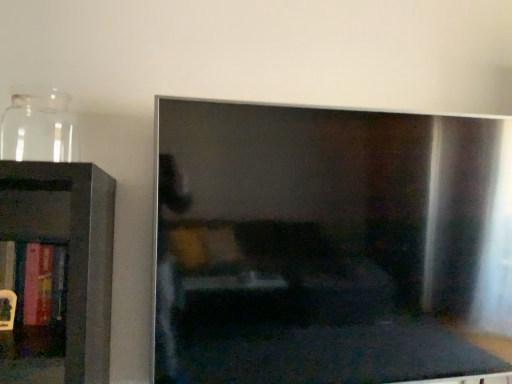
Question: Is transparent glass jar at left next to hardcover book at left?

Choices:
 (A) no
 (B) yes

Answer: (A)

Question: Considering the relative sizes of transparent glass jar at left and hardcover book at left in the image provided, is transparent glass jar at left shorter than hardcover book at left?

Choices:
 (A) no
 (B) yes

Answer: (B)

Question: Considering the relative positions of transparent glass jar at left and hardcover book at left in the image provided, is transparent glass jar at left behind hardcover book at left?

Choices:
 (A) no
 (B) yes

Answer: (A)

Question: Considering the relative positions of transparent glass jar at left and hardcover book at left in the image provided, is transparent glass jar at left in front of hardcover book at left?

Choices:
 (A) yes
 (B) no

Answer: (A)

Question: From a real-world perspective, is transparent glass jar at left located higher than hardcover book at left?

Choices:
 (A) yes
 (B) no

Answer: (A)

Question: From the image's perspective, is transparent glass jar at left located above hardcover book at left?

Choices:
 (A) no
 (B) yes

Answer: (B)

Question: Is hardcover book at left oriented towards transparent glass jar at left?

Choices:
 (A) no
 (B) yes

Answer: (A)

Question: Is hardcover book at left at the left side of transparent glass jar at left?

Choices:
 (A) yes
 (B) no

Answer: (A)

Question: From the image's perspective, does hardcover book at left appear lower than transparent glass jar at left?

Choices:
 (A) no
 (B) yes

Answer: (B)

Question: Are hardcover book at left and transparent glass jar at left far apart?

Choices:
 (A) no
 (B) yes

Answer: (A)

Question: Considering the relative sizes of hardcover book at left and transparent glass jar at left in the image provided, is hardcover book at left bigger than transparent glass jar at left?

Choices:
 (A) yes
 (B) no

Answer: (A)

Question: Is hardcover book at left next to transparent glass jar at left and touching it?

Choices:
 (A) no
 (B) yes

Answer: (A)

Question: Do you think transparent glass jar at left is within hardcover book at left, or outside of it?

Choices:
 (A) outside
 (B) inside

Answer: (A)